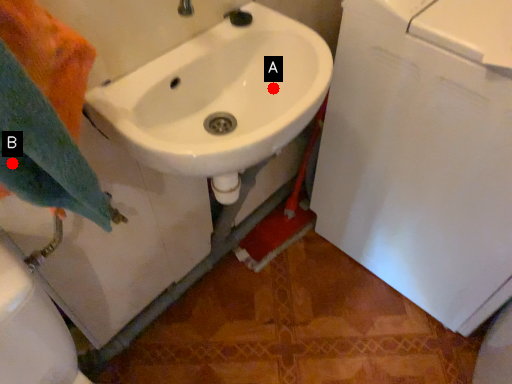
Question: Two points are circled on the image, labeled by A and B beside each circle. Among these points, which one is nearest to the camera?

Choices:
 (A) A is closer
 (B) B is closer

Answer: (B)